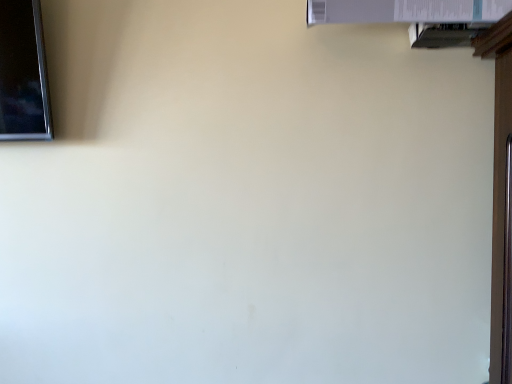
This screenshot has width=512, height=384. What do you see at coordinates (405, 11) in the screenshot?
I see `white plastic window at upper right` at bounding box center [405, 11].

Where is `white plastic window at upper right`? This screenshot has width=512, height=384. white plastic window at upper right is located at coordinates (405, 11).

The height and width of the screenshot is (384, 512). What are the coordinates of `white plastic window at upper right` in the screenshot? It's located at (405, 11).